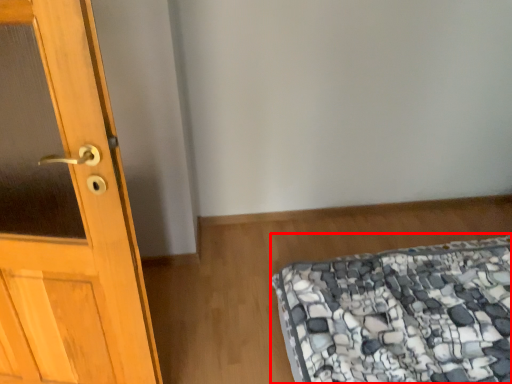
Question: In this image, where is mattress (annotated by the red box) located relative to door?

Choices:
 (A) right
 (B) left

Answer: (A)